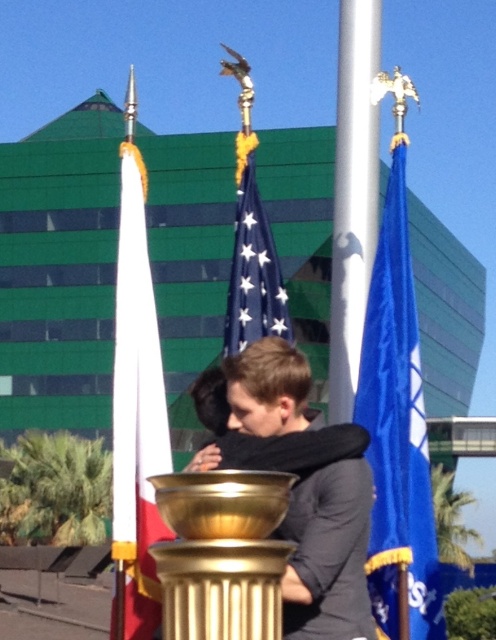
Question: Can you confirm if blue fabric flag at right is thinner than silver metallic flag pole at center?

Choices:
 (A) no
 (B) yes

Answer: (B)

Question: Which of the following is the closest to the observer?

Choices:
 (A) (286, 349)
 (B) (152, 518)
 (C) (351, 104)
 (D) (417, 547)

Answer: (B)

Question: Is dark gray sweater at center to the left of blue fabric flag at right from the viewer's perspective?

Choices:
 (A) no
 (B) yes

Answer: (B)

Question: Can you confirm if dark gray sweater at center is wider than white fabric flag at left?

Choices:
 (A) yes
 (B) no

Answer: (B)

Question: Which point is farther from the camera taking this photo?

Choices:
 (A) (382, 486)
 (B) (248, 284)
 (C) (136, 636)
 (D) (365, 438)

Answer: (B)

Question: Which object is positioned closest to the dark gray sweater at center?

Choices:
 (A) blue fabric flag at right
 (B) white fabric flag at left
 (C) silver metallic flag pole at center
 (D) blue fabric flag at center

Answer: (A)